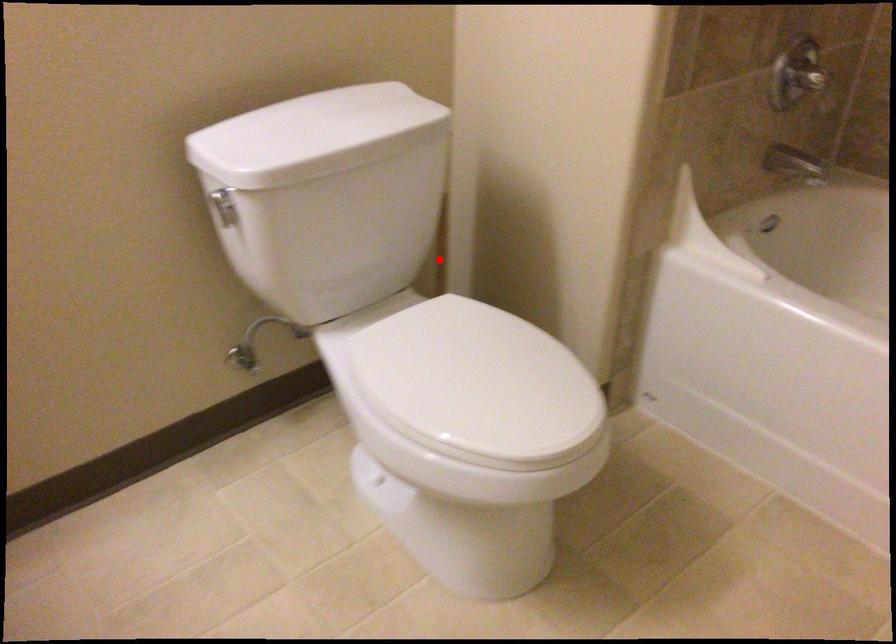
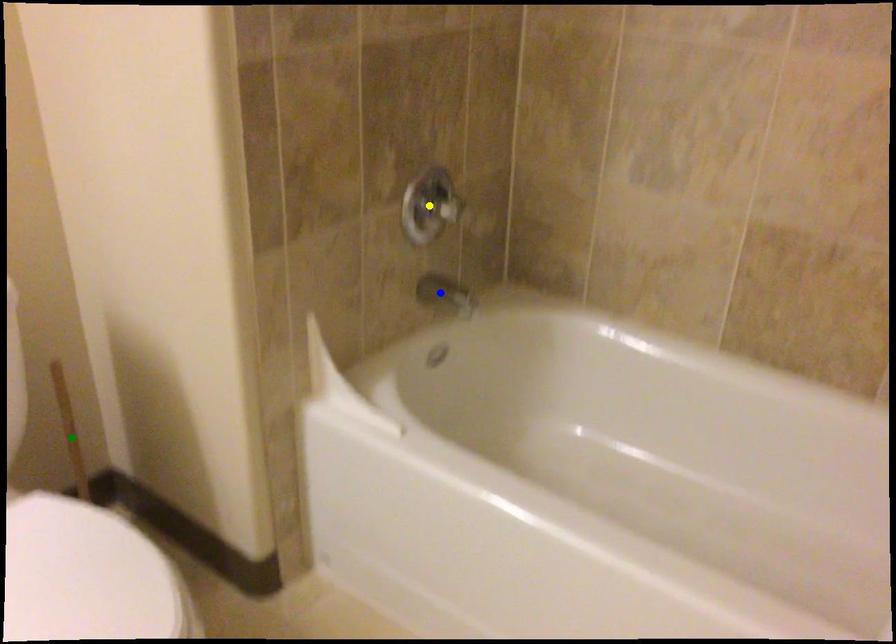
Question: I am providing you with two images of the same scene from different viewpoints. A red point is marked on the first image. You are given multiple points on the second image. Which mark in image 2 goes with the point in image 1?

Choices:
 (A) green point
 (B) blue point
 (C) yellow point

Answer: (A)